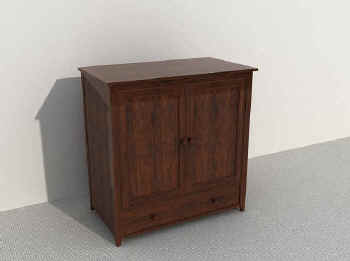
Locate an element on the screen. wood knob is located at coordinates (214, 202), (156, 219), (183, 143), (190, 141).